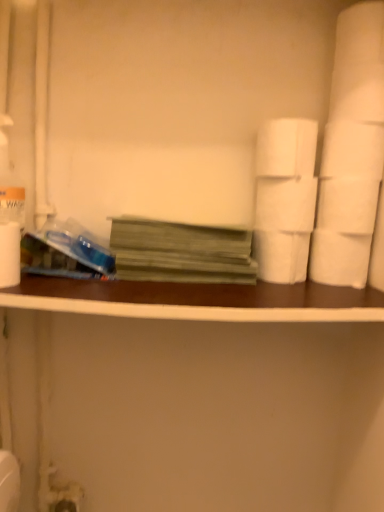
Question: Considering the relative positions of white matte paper towel at left and white matte toilet paper at upper right, which is the first toilet paper in top-to-bottom order, in the image provided, is white matte paper towel at left to the left or to the right of white matte toilet paper at upper right, which is the first toilet paper in top-to-bottom order,?

Choices:
 (A) right
 (B) left

Answer: (B)

Question: Is point (6, 256) positioned closer to the camera than point (258, 141)?

Choices:
 (A) farther
 (B) closer

Answer: (B)

Question: Which of these objects is positioned farthest from the white matte toilet paper at right, arranged as the first toilet paper when ordered from the bottom?

Choices:
 (A) white matte toilet paper at right, the second toilet paper ordered from the bottom
 (B) green matte book at center
 (C) white matte toilet paper at right, acting as the third toilet paper starting from the top
 (D) white matte paper towel at left
 (E) white matte toilet paper at center right, the fourth toilet paper ordered from the bottom

Answer: (D)

Question: Which object is the farthest from the white matte toilet paper at center right, the second toilet paper when ordered from top to bottom?

Choices:
 (A) brown wood ledge at center
 (B) white matte toilet paper at right, which is the 3th toilet paper in bottom-to-top order
 (C) white matte toilet paper at upper right, the fifth toilet paper when ordered from bottom to top
 (D) green matte book at center
 (E) white matte toilet paper at right, the 5th toilet paper when ordered from top to bottom

Answer: (A)